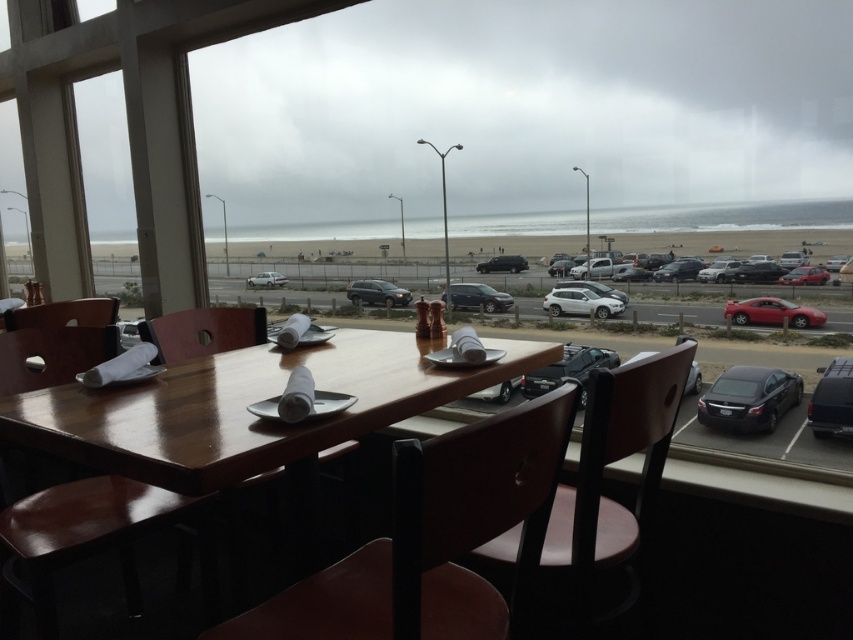
You are a customer sitting at the wooden table with dark wood chairs. You want to go to the glossy red car at right. Which direction should you walk from the table to reach the car?

The glossy red car at right is located at point (x=772, y=312), so you should walk towards the right side of the scene from the table to reach the car.

You are a delivery person trying to park your truck next to the white matte car at center. The parking spot next to it is occupied by the black matte van at lower right. Can your truck fit in the remaining space between them?

The black matte van at lower right is larger in size than the white matte car at center. Therefore, the space between them might be insufficient for your truck to fit comfortably. Check for a larger parking spot.